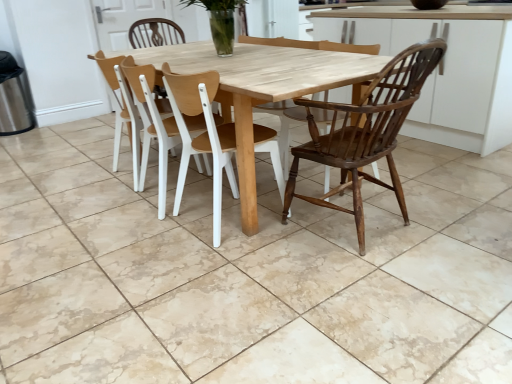
Identify the location of free space to the left of dark brown wood chair at right, marked as the third chair in a left-to-right arrangement. This screenshot has width=512, height=384. (261, 251).